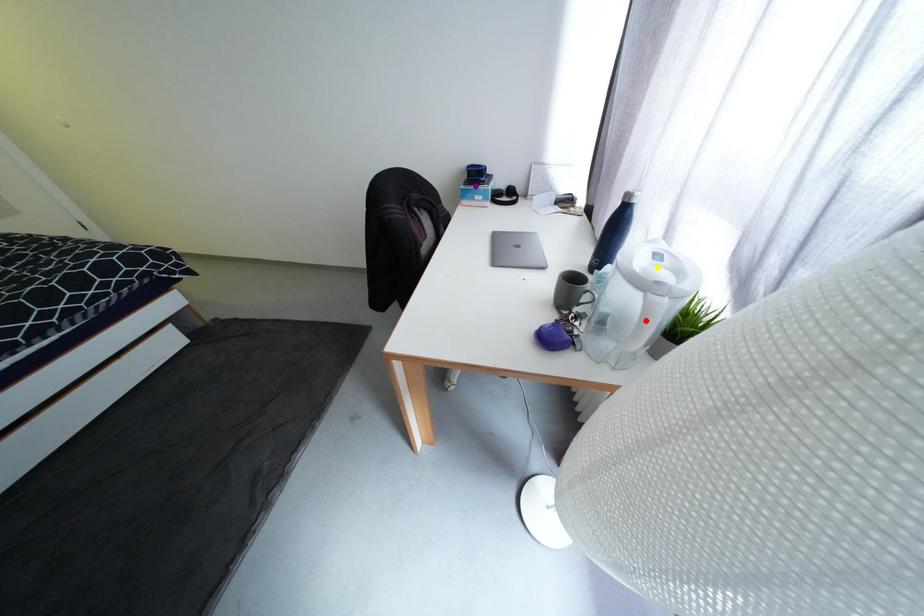
Order these from farthest to nearest:
purple point, yellow point, red point

purple point, yellow point, red point